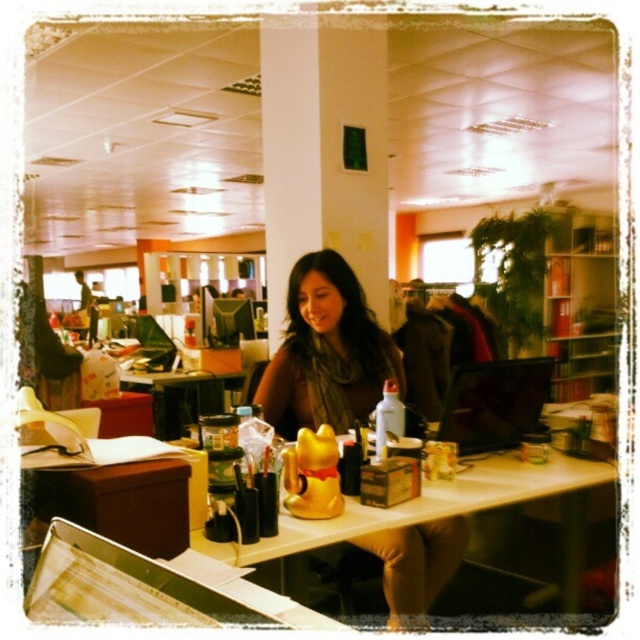
From the picture: Can you confirm if matte gold statue at center is positioned to the right of white glossy table at center?

In fact, matte gold statue at center is to the left of white glossy table at center.

Between point (380, 349) and point (568, 522), which one is positioned in front?

Point (568, 522) is in front.

Locate an element on the screen. The width and height of the screenshot is (640, 640). matte gold statue at center is located at coordinates (326, 353).

Which is below, matte gold statue at center or brown hair at center?

brown hair at center

Does point (445, 554) come closer to viewer compared to point (296, 300)?

Yes, it is.

At what (x,y) coordinates should I click in order to perform the action: click on matte gold statue at center. Please return your answer as a coordinate pair (x, y). Looking at the image, I should click on (326, 353).

Locate an element on the screen. matte gold statue at center is located at coordinates (326, 353).

Does brown hair at center have a smaller size compared to white glossy table at center?

Yes, brown hair at center is smaller than white glossy table at center.

Can you confirm if brown hair at center is thinner than white glossy table at center?

Correct, brown hair at center's width is less than white glossy table at center's.

Which is behind, point (330, 365) or point (516, 458)?

The point (330, 365) is behind.

Where is `brown hair at center`? The height and width of the screenshot is (640, 640). brown hair at center is located at coordinates (326, 353).